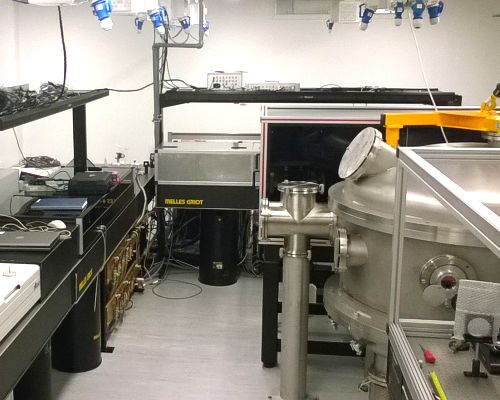
Find the location of a particular element. temperature dial is located at coordinates (352, 151).